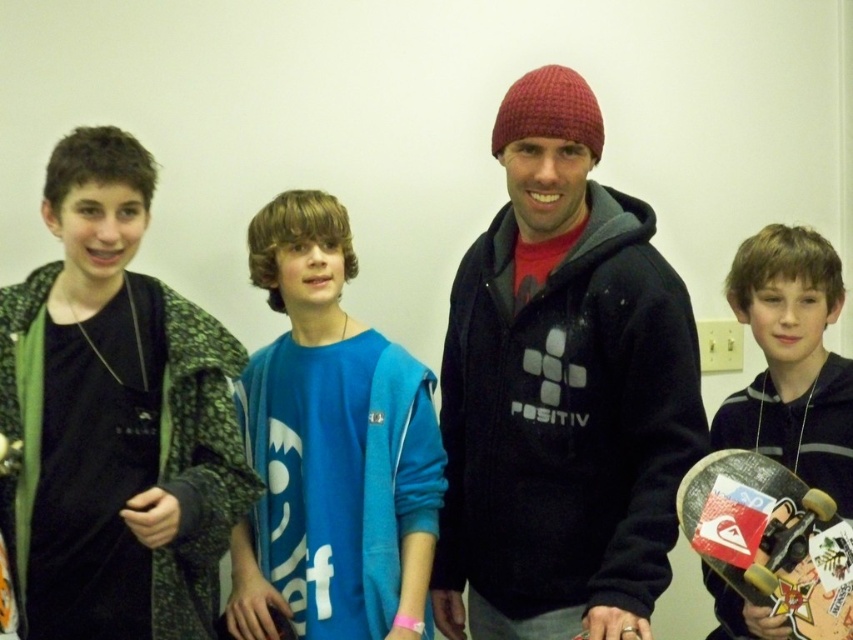
Can you confirm if dark gray hoodie at center is positioned above matte black skateboard at right?

Actually, dark gray hoodie at center is below matte black skateboard at right.

Does point (645, 266) lie in front of point (850, 435)?

Yes, point (645, 266) is closer to viewer.

Locate an element on the screen. dark gray hoodie at center is located at coordinates (561, 392).

Between dark gray hoodie at center and blue cotton shirt at center, which one has less height?

Standing shorter between the two is blue cotton shirt at center.

What do you see at coordinates (561, 392) in the screenshot? This screenshot has width=853, height=640. I see `dark gray hoodie at center` at bounding box center [561, 392].

Between point (604, 406) and point (334, 276), which one is positioned in front?

Positioned in front is point (604, 406).

The width and height of the screenshot is (853, 640). Identify the location of dark gray hoodie at center. (561, 392).

Who is more distant from viewer, [584,492] or [842,596]?

Point [584,492]

Is dark gray hoodie at center wider than black matte skateboard at lower right?

Indeed, dark gray hoodie at center has a greater width compared to black matte skateboard at lower right.

This screenshot has height=640, width=853. I want to click on dark gray hoodie at center, so click(561, 392).

Image resolution: width=853 pixels, height=640 pixels. Identify the location of dark gray hoodie at center. (561, 392).